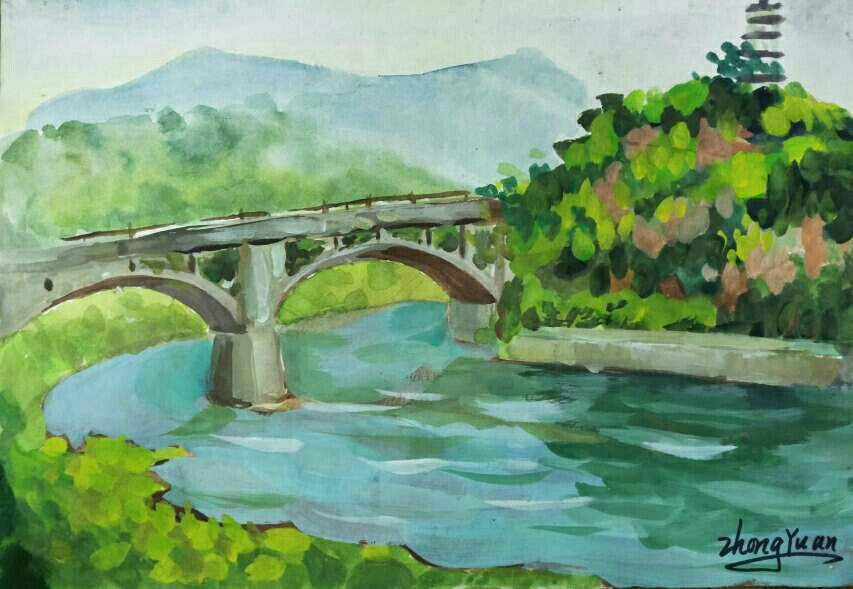
Find the location of a particular element. Image resolution: width=853 pixels, height=589 pixels. art is located at coordinates (393, 463).